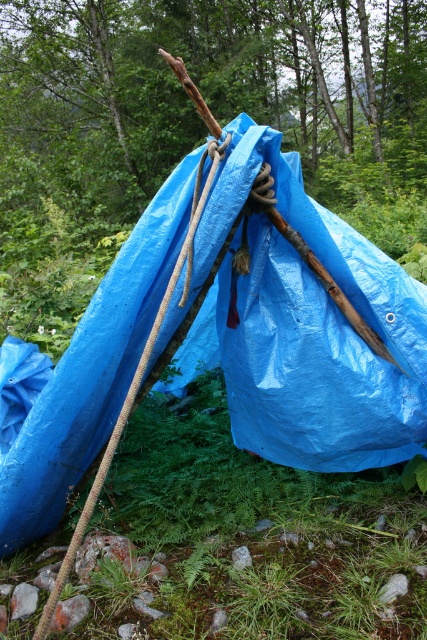
You are a hiker carrying a backpack that is 1.5 meters wide. You want to walk under the blue tarpaulin at center. Can your backpack fit through the space between you and the tarpaulin without touching it?

The distance between you and the blue tarpaulin at center is 1.63 meters. Since your backpack is 1.5 meters wide, it should fit through the space as there is enough clearance. However, you may need to adjust your position to ensure it doesn

You are a hiker who needs to secure your tent. You see a blue tarpaulin at center and a roperoughrope at left. Which object is positioned higher in the scene?

The roperoughrope at left is positioned higher than the blue tarpaulin at center.